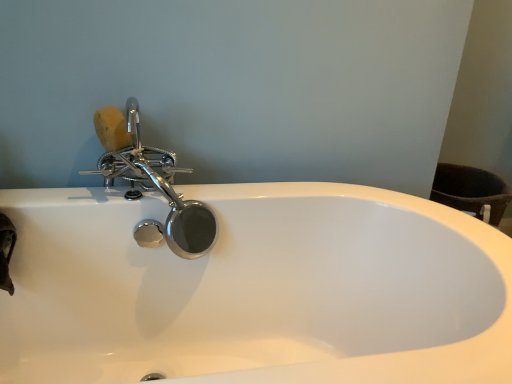
Describe the element at coordinates (151, 183) in the screenshot. I see `polished chrome faucet at upper left` at that location.

What is the approximate height of polished chrome faucet at upper left?

polished chrome faucet at upper left is 16.69 inches tall.

Where is `polished chrome faucet at upper left`? This screenshot has width=512, height=384. polished chrome faucet at upper left is located at coordinates (151, 183).

Identify the location of natural sponge at upper left. [112, 128].

Measure the distance between natural sponge at upper left and camera.

A distance of 1.10 meters exists between natural sponge at upper left and camera.

This screenshot has width=512, height=384. What do you see at coordinates (112, 128) in the screenshot? I see `natural sponge at upper left` at bounding box center [112, 128].

I want to click on polished chrome faucet at upper left, so click(x=151, y=183).

From the picture: Which object is positioned more to the left, natural sponge at upper left or polished chrome faucet at upper left?

From the viewer's perspective, natural sponge at upper left appears more on the left side.

Which is behind, natural sponge at upper left or polished chrome faucet at upper left?

Positioned behind is natural sponge at upper left.

Does point (110, 141) appear closer or farther from the camera than point (167, 172)?

Point (110, 141) is closer to the camera than point (167, 172).

From the image's perspective, who appears lower, natural sponge at upper left or polished chrome faucet at upper left?

polished chrome faucet at upper left appears lower in the image.

From a real-world perspective, which is physically above, natural sponge at upper left or polished chrome faucet at upper left?

natural sponge at upper left, from a real-world perspective.

Which of these two, natural sponge at upper left or polished chrome faucet at upper left, is thinner?

With smaller width is natural sponge at upper left.

Considering the sizes of objects natural sponge at upper left and polished chrome faucet at upper left in the image provided, who is shorter, natural sponge at upper left or polished chrome faucet at upper left?

natural sponge at upper left is shorter.

Does natural sponge at upper left have a larger size compared to polished chrome faucet at upper left?

Incorrect, natural sponge at upper left is not larger than polished chrome faucet at upper left.

Does natural sponge at upper left contain polished chrome faucet at upper left?

Definitely not — polished chrome faucet at upper left is not inside natural sponge at upper left.

Is natural sponge at upper left touching polished chrome faucet at upper left?

No, natural sponge at upper left is not touching polished chrome faucet at upper left.

Is natural sponge at upper left oriented towards polished chrome faucet at upper left?

Yes, natural sponge at upper left is aimed at polished chrome faucet at upper left.

Identify the location of tap that is below the natural sponge at upper left (from the image's perspective). Image resolution: width=512 pixels, height=384 pixels. click(151, 183).

Based on their positions, is polished chrome faucet at upper left located to the left or right of natural sponge at upper left?

In the image, polished chrome faucet at upper left appears on the right side of natural sponge at upper left.

Is polished chrome faucet at upper left positioned before natural sponge at upper left?

Yes, it is.

Does point (189, 217) come closer to viewer compared to point (120, 127)?

That is True.

From the image's perspective, is polished chrome faucet at upper left located above or below natural sponge at upper left?

polished chrome faucet at upper left is below natural sponge at upper left.

From a real-world perspective, is polished chrome faucet at upper left positioned above or below natural sponge at upper left?

From a real-world perspective, polished chrome faucet at upper left is physically below natural sponge at upper left.

Does polished chrome faucet at upper left have a lesser width compared to natural sponge at upper left?

No.

Which of these two, polished chrome faucet at upper left or natural sponge at upper left, stands taller?

With more height is polished chrome faucet at upper left.

Can you confirm if polished chrome faucet at upper left is bigger than natural sponge at upper left?

Yes.

Would you say polished chrome faucet at upper left is inside or outside natural sponge at upper left?

polished chrome faucet at upper left is spatially situated outside natural sponge at upper left.

Does polished chrome faucet at upper left touch natural sponge at upper left?

No, polished chrome faucet at upper left is not next to natural sponge at upper left.

Is polished chrome faucet at upper left oriented away from natural sponge at upper left?

Yes, polished chrome faucet at upper left is positioned with its back facing natural sponge at upper left.

Based on the photo, can you tell me how much polished chrome faucet at upper left and natural sponge at upper left differ in facing direction?

28.6 degrees.

Locate an element on the screen. The image size is (512, 384). soap that is above the polished chrome faucet at upper left (from a real-world perspective) is located at coordinates (112, 128).

I want to click on soap located above the polished chrome faucet at upper left (from a real-world perspective), so click(x=112, y=128).

Identify the location of soap lying above the polished chrome faucet at upper left (from the image's perspective). (112, 128).